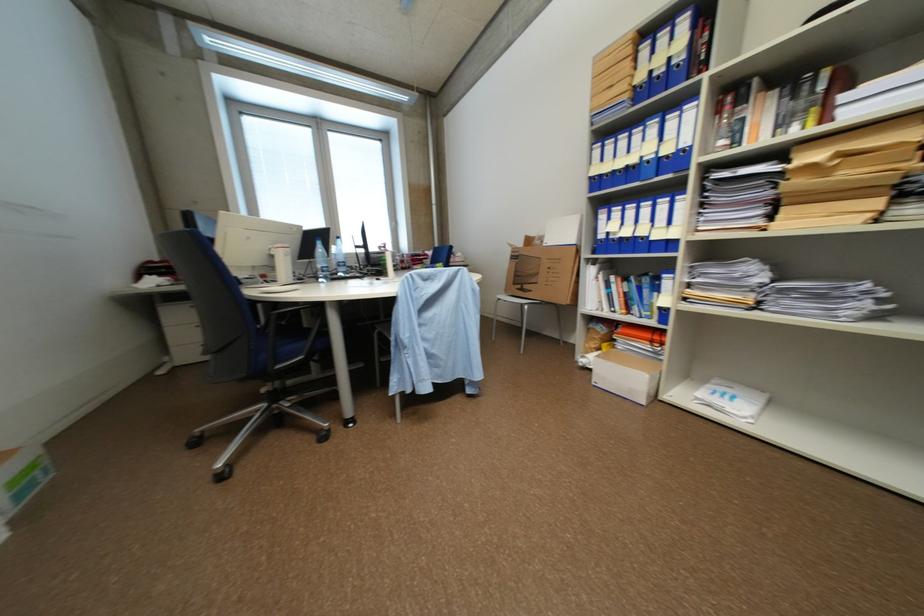
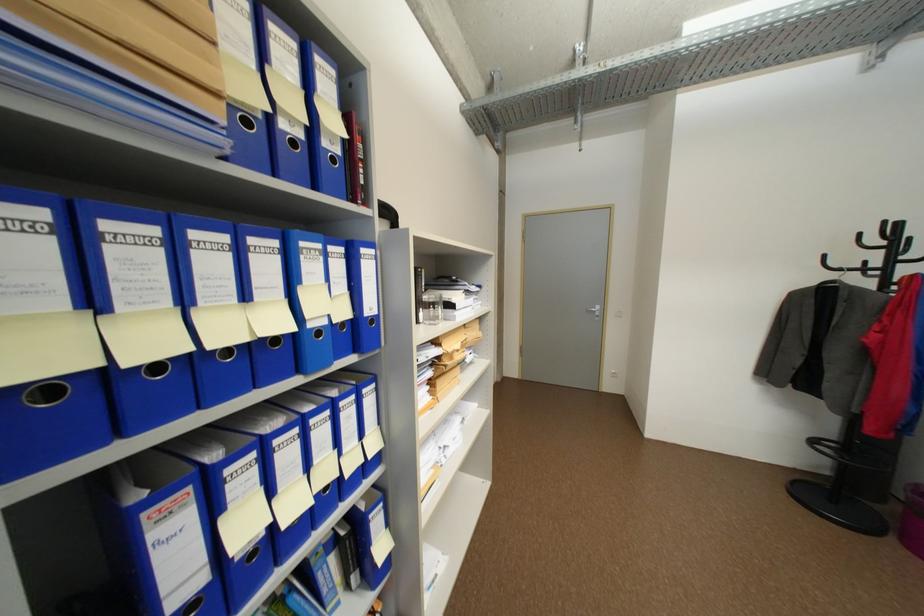
Find the pixel in the second image that matches [628,172] in the first image.

(236, 352)